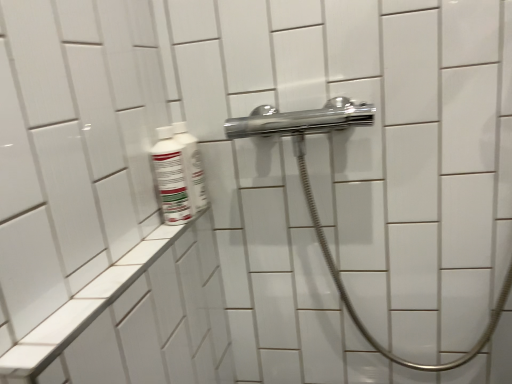
Question: From a real-world perspective, is white glossy bottle at upper left, which is the 2th mouthwash in front-to-back order, positioned above or below white glossy bottle at left, the second mouthwash positioned from the back?

Choices:
 (A) above
 (B) below

Answer: (A)

Question: Is point pyautogui.click(x=194, y=208) positioned closer to the camera than point pyautogui.click(x=162, y=190)?

Choices:
 (A) farther
 (B) closer

Answer: (A)

Question: Which object is the closest to the white ceramic ledge at lower left?

Choices:
 (A) white glossy bottle at upper left, which is the 2th mouthwash in front-to-back order
 (B) white glossy bottle at left, placed as the first mouthwash when sorted from front to back

Answer: (B)

Question: Estimate the real-world distances between objects in this image. Which object is closer to the white glossy bottle at upper left, which is the 2th mouthwash in front-to-back order?

Choices:
 (A) white ceramic ledge at lower left
 (B) white glossy bottle at left, placed as the first mouthwash when sorted from front to back

Answer: (B)